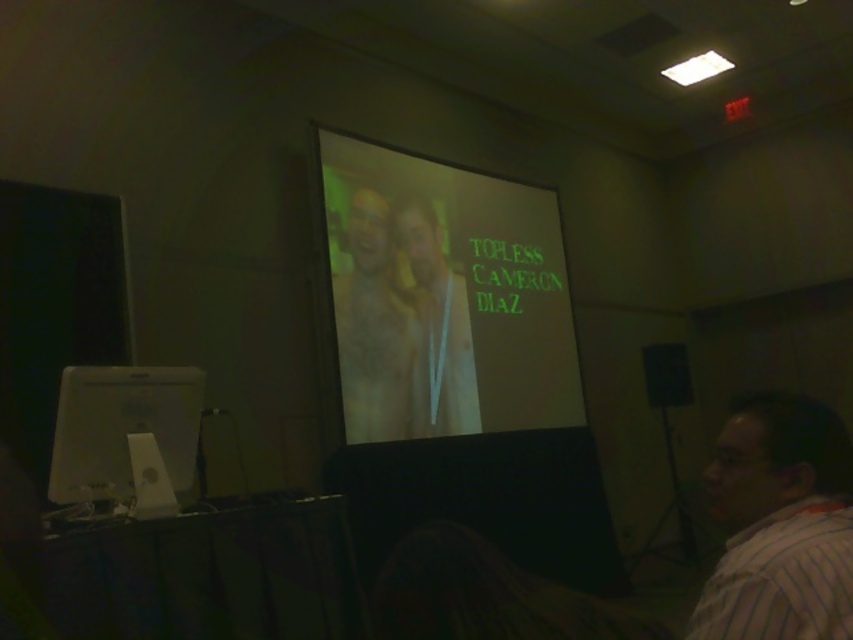
Can you confirm if smooth beige statue at center is positioned to the right of matte yellow shirt at center?

In fact, smooth beige statue at center is to the left of matte yellow shirt at center.

Is smooth beige statue at center behind matte yellow shirt at center?

No, smooth beige statue at center is in front of matte yellow shirt at center.

Who is more distant from viewer, (376, 326) or (428, 285)?

Point (428, 285)

At what (x,y) coordinates should I click in order to perform the action: click on smooth beige statue at center. Please return your answer as a coordinate pair (x, y). The height and width of the screenshot is (640, 853). Looking at the image, I should click on (374, 328).

Looking at this image, can you confirm if white glossy computer screen at lower left is shorter than matte yellow shirt at center?

Yes.

Between white glossy computer screen at lower left and matte yellow shirt at center, which one appears on the left side from the viewer's perspective?

Positioned to the left is white glossy computer screen at lower left.

Where is `white glossy computer screen at lower left`? This screenshot has width=853, height=640. white glossy computer screen at lower left is located at coordinates point(122,428).

Can you confirm if white glossy computer screen at lower left is thinner than smooth beige statue at center?

Correct, white glossy computer screen at lower left's width is less than smooth beige statue at center's.

Is point (169, 433) in front of point (387, 240)?

Yes.

Locate an element on the screen. The width and height of the screenshot is (853, 640). white glossy computer screen at lower left is located at coordinates (122, 428).